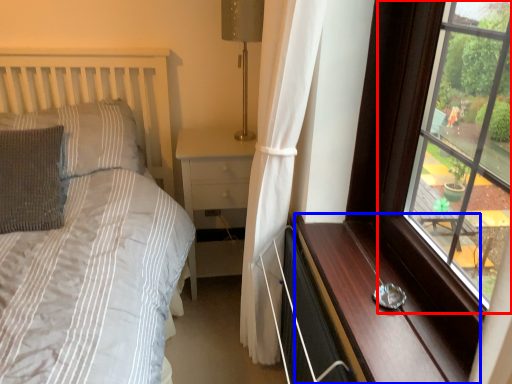
Question: Which of the following is the farthest to the observer, window (highlighted by a red box) or dresser (highlighted by a blue box)?

Choices:
 (A) window
 (B) dresser

Answer: (B)